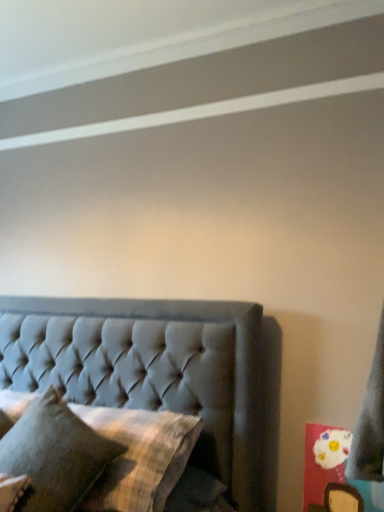
This screenshot has width=384, height=512. Describe the element at coordinates (55, 455) in the screenshot. I see `textured gray pillow at lower left, the second pillow positioned from the bottom` at that location.

The height and width of the screenshot is (512, 384). Identify the location of textured gray pillow at lower left, which appears as the first pillow when viewed from the top. (55, 455).

From the picture: How much space does plaid fabric pillow at center, positioned as the second pillow in top-to-bottom order, occupy vertically?

It is 7.55 inches.

The height and width of the screenshot is (512, 384). Describe the element at coordinates (139, 456) in the screenshot. I see `plaid fabric pillow at center, positioned as the second pillow in top-to-bottom order` at that location.

Image resolution: width=384 pixels, height=512 pixels. Find the location of `tufted fabric bed at center`. tufted fabric bed at center is located at coordinates (150, 368).

From the image's perspective, which is above, textured gray pillow at lower left, the second pillow positioned from the bottom, or tufted fabric bed at center?

From the image's view, textured gray pillow at lower left, the second pillow positioned from the bottom, is above.

Is textured gray pillow at lower left, the second pillow positioned from the bottom, thinner than tufted fabric bed at center?

No, textured gray pillow at lower left, the second pillow positioned from the bottom, is not thinner than tufted fabric bed at center.

Does textured gray pillow at lower left, the second pillow positioned from the bottom, have a greater height compared to tufted fabric bed at center?

No.

Is textured gray pillow at lower left, which appears as the first pillow when viewed from the top, far from tufted fabric bed at center?

Actually, textured gray pillow at lower left, which appears as the first pillow when viewed from the top, and tufted fabric bed at center are a little close together.

You are a GUI agent. You are given a task and a screenshot of the screen. Output one action in this format:
    pyautogui.click(x=<x>, y=<y>)
    Task: Click on the bed below the textured gray pillow at lower left, the second pillow positioned from the bottom (from the image's perspective)
    The height and width of the screenshot is (512, 384).
    Given the screenshot: What is the action you would take?
    pyautogui.click(x=150, y=368)

Between tufted fabric bed at center and textured gray pillow at lower left, which appears as the first pillow when viewed from the top, which one has smaller width?

Thinner between the two is tufted fabric bed at center.

From the image's perspective, is tufted fabric bed at center positioned above or below textured gray pillow at lower left, the second pillow positioned from the bottom?

tufted fabric bed at center is situated lower than textured gray pillow at lower left, the second pillow positioned from the bottom, in the image.

In the image, is plaid fabric pillow at center, positioned as the second pillow in top-to-bottom order, on the left side or the right side of tufted fabric bed at center?

plaid fabric pillow at center, positioned as the second pillow in top-to-bottom order, is to the right of tufted fabric bed at center.

In the image, is plaid fabric pillow at center, arranged as the 1th pillow when ordered from the bottom, positioned in front of or behind tufted fabric bed at center?

In the image, plaid fabric pillow at center, arranged as the 1th pillow when ordered from the bottom, appears behind tufted fabric bed at center.

Which object is wider, plaid fabric pillow at center, positioned as the second pillow in top-to-bottom order, or tufted fabric bed at center?

With larger width is tufted fabric bed at center.

From the image's perspective, which one is positioned lower, plaid fabric pillow at center, positioned as the second pillow in top-to-bottom order, or tufted fabric bed at center?

plaid fabric pillow at center, positioned as the second pillow in top-to-bottom order, is shown below in the image.

From a real-world perspective, who is located lower, textured gray pillow at lower left, the second pillow positioned from the bottom, or plaid fabric pillow at center, arranged as the 1th pillow when ordered from the bottom?

plaid fabric pillow at center, arranged as the 1th pillow when ordered from the bottom.

Between textured gray pillow at lower left, the second pillow positioned from the bottom, and plaid fabric pillow at center, positioned as the second pillow in top-to-bottom order, which one has larger width?

textured gray pillow at lower left, the second pillow positioned from the bottom.

Which object is further away from the camera taking this photo, textured gray pillow at lower left, which appears as the first pillow when viewed from the top, or plaid fabric pillow at center, positioned as the second pillow in top-to-bottom order?

plaid fabric pillow at center, positioned as the second pillow in top-to-bottom order, is further away from the camera.

At what (x,y) coordinates should I click in order to perform the action: click on pillow located on the left of plaid fabric pillow at center, arranged as the 1th pillow when ordered from the bottom. Please return your answer as a coordinate pair (x, y). This screenshot has width=384, height=512. Looking at the image, I should click on (55, 455).

Between plaid fabric pillow at center, positioned as the second pillow in top-to-bottom order, and textured gray pillow at lower left, the second pillow positioned from the bottom, which one has more height?

textured gray pillow at lower left, the second pillow positioned from the bottom.

Is textured gray pillow at lower left, which appears as the first pillow when viewed from the top, inside plaid fabric pillow at center, positioned as the second pillow in top-to-bottom order?

No, textured gray pillow at lower left, which appears as the first pillow when viewed from the top, is located outside of plaid fabric pillow at center, positioned as the second pillow in top-to-bottom order.

Who is smaller, plaid fabric pillow at center, arranged as the 1th pillow when ordered from the bottom, or textured gray pillow at lower left, the second pillow positioned from the bottom?

Smaller between the two is plaid fabric pillow at center, arranged as the 1th pillow when ordered from the bottom.

Is plaid fabric pillow at center, positioned as the second pillow in top-to-bottom order, next to textured gray pillow at lower left, the second pillow positioned from the bottom, and touching it?

plaid fabric pillow at center, positioned as the second pillow in top-to-bottom order, is not next to textured gray pillow at lower left, the second pillow positioned from the bottom, and they're not touching.

Is tufted fabric bed at center turned away from plaid fabric pillow at center, arranged as the 1th pillow when ordered from the bottom?

Absolutely, tufted fabric bed at center is directed away from plaid fabric pillow at center, arranged as the 1th pillow when ordered from the bottom.

Between tufted fabric bed at center and plaid fabric pillow at center, arranged as the 1th pillow when ordered from the bottom, which one has more height?

tufted fabric bed at center.

How far apart are tufted fabric bed at center and plaid fabric pillow at center, positioned as the second pillow in top-to-bottom order?

tufted fabric bed at center is 13.88 inches away from plaid fabric pillow at center, positioned as the second pillow in top-to-bottom order.

Is tufted fabric bed at center beside plaid fabric pillow at center, positioned as the second pillow in top-to-bottom order?

No, tufted fabric bed at center is not in contact with plaid fabric pillow at center, positioned as the second pillow in top-to-bottom order.

You are a GUI agent. You are given a task and a screenshot of the screen. Output one action in this format:
    pyautogui.click(x=<x>, y=<y>)
    Task: Click on the bed below the textured gray pillow at lower left, the second pillow positioned from the bottom (from a real-world perspective)
    
    Given the screenshot: What is the action you would take?
    pyautogui.click(x=150, y=368)

This screenshot has width=384, height=512. In order to click on pillow above the tufted fabric bed at center (from a real-world perspective) in this screenshot , I will do `click(55, 455)`.

Estimate the real-world distances between objects in this image. Which object is further from plaid fabric pillow at center, arranged as the 1th pillow when ordered from the bottom, textured gray pillow at lower left, which appears as the first pillow when viewed from the top, or tufted fabric bed at center?

tufted fabric bed at center is positioned further to the anchor plaid fabric pillow at center, arranged as the 1th pillow when ordered from the bottom.

Considering their positions, is plaid fabric pillow at center, arranged as the 1th pillow when ordered from the bottom, positioned closer to textured gray pillow at lower left, the second pillow positioned from the bottom, than tufted fabric bed at center?

plaid fabric pillow at center, arranged as the 1th pillow when ordered from the bottom, lies closer to textured gray pillow at lower left, the second pillow positioned from the bottom, than the other object.

Estimate the real-world distances between objects in this image. Which object is further from tufted fabric bed at center, plaid fabric pillow at center, arranged as the 1th pillow when ordered from the bottom, or textured gray pillow at lower left, the second pillow positioned from the bottom?

textured gray pillow at lower left, the second pillow positioned from the bottom, is positioned further to the anchor tufted fabric bed at center.

Based on the photo, estimate the real-world distances between objects in this image. Which object is closer to plaid fabric pillow at center, arranged as the 1th pillow when ordered from the bottom, tufted fabric bed at center or textured gray pillow at lower left, the second pillow positioned from the bottom?

textured gray pillow at lower left, the second pillow positioned from the bottom, is positioned closer to the anchor plaid fabric pillow at center, arranged as the 1th pillow when ordered from the bottom.

When comparing their distances from tufted fabric bed at center, does textured gray pillow at lower left, the second pillow positioned from the bottom, or plaid fabric pillow at center, arranged as the 1th pillow when ordered from the bottom, seem closer?

plaid fabric pillow at center, arranged as the 1th pillow when ordered from the bottom, is positioned closer to the anchor tufted fabric bed at center.

Based on their spatial positions, is tufted fabric bed at center or plaid fabric pillow at center, arranged as the 1th pillow when ordered from the bottom, further from textured gray pillow at lower left, which appears as the first pillow when viewed from the top?

tufted fabric bed at center is further to textured gray pillow at lower left, which appears as the first pillow when viewed from the top.

This screenshot has width=384, height=512. I want to click on bed between textured gray pillow at lower left, the second pillow positioned from the bottom, and plaid fabric pillow at center, positioned as the second pillow in top-to-bottom order, so click(x=150, y=368).